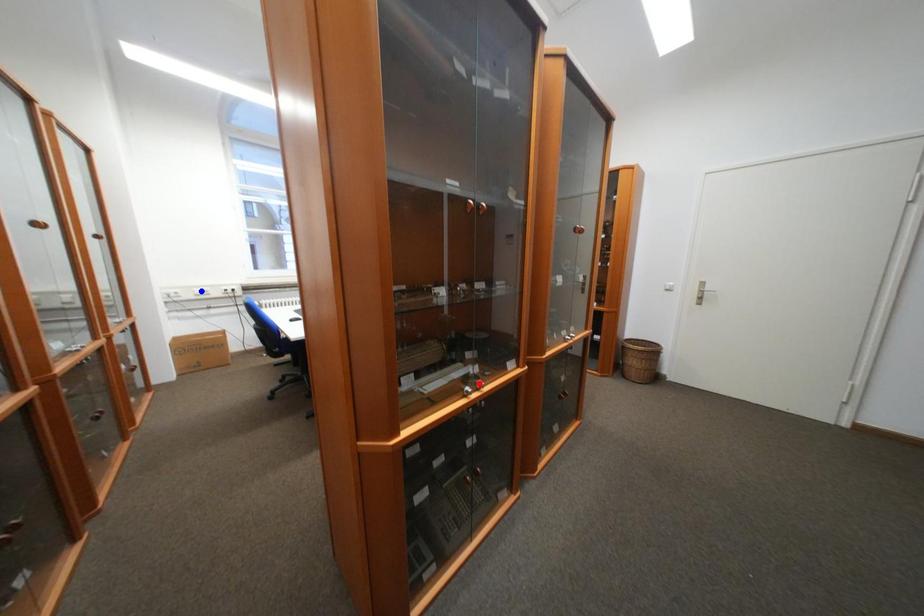
Question: Which of the two points in the image is closer to the camera?

Choices:
 (A) Blue point is closer.
 (B) Red point is closer.

Answer: (B)